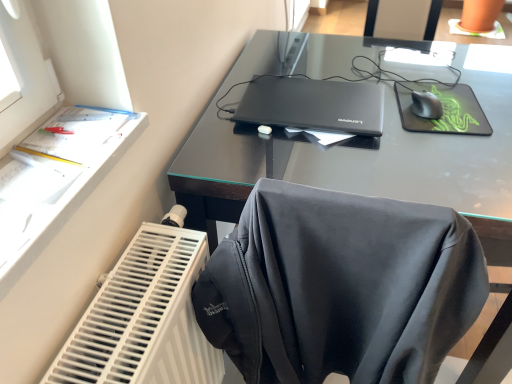
Locate an element on the screen. The width and height of the screenshot is (512, 384). free space in front of black matte mouse at upper right is located at coordinates (436, 146).